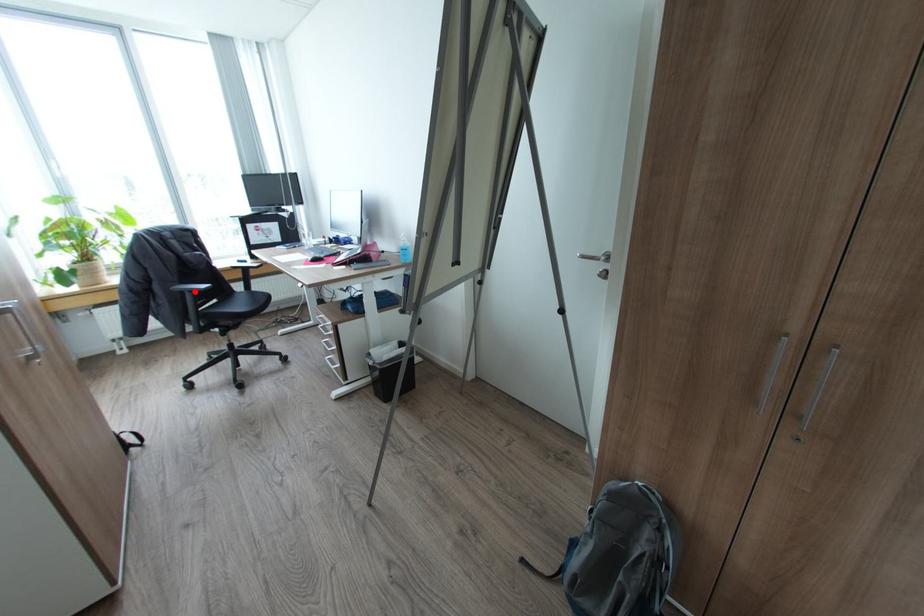
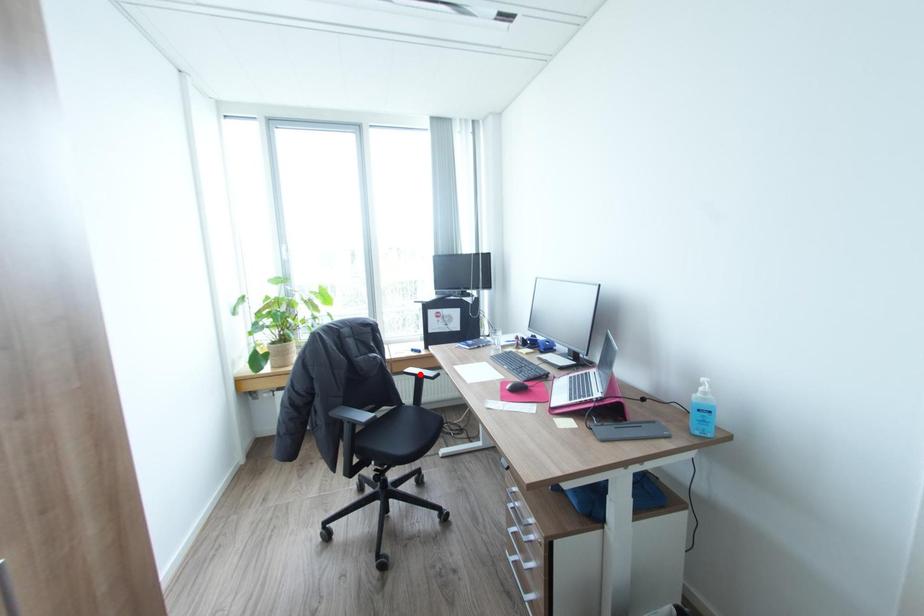
I am providing you with two images of the same scene from different viewpoints. A red point is marked on the first image and another point is marked on the second image. Are the points marked in image1 and image2 representing the same 3D position?

No